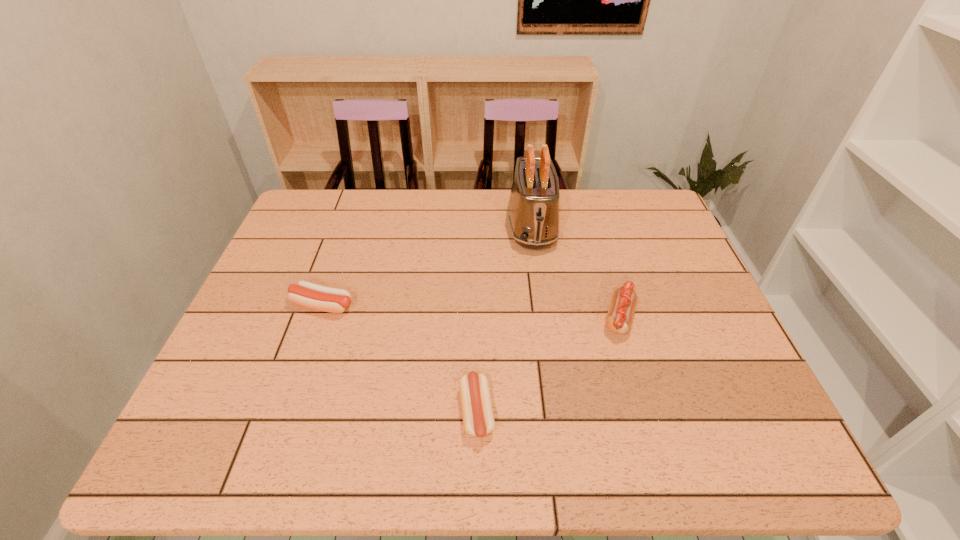
Select which object is the third closest to the leftmost sausage. Please provide its 2D coordinates. Your answer should be formatted as a tuple, i.e. [(x, y)], where the tuple contains the x and y coordinates of a point satisfying the conditions above.

[(619, 318)]

This screenshot has height=540, width=960. In order to click on sausage that is the closest to the toaster in this screenshot , I will do `click(619, 318)`.

Identify the location of sausage identified as the second closest to the leftmost sausage. (619, 318).

Locate an element on the screen. This screenshot has height=540, width=960. vacant space that satisfies the following two spatial constraints: 1. on the side of the farthest object with the control lever; 2. on the left side of the rightmost sausage is located at coordinates (544, 318).

This screenshot has width=960, height=540. In order to click on free space that satisfies the following two spatial constraints: 1. on the front side of the leftmost object; 2. on the left side of the nearest sausage in this screenshot , I will do `click(285, 413)`.

This screenshot has height=540, width=960. What are the coordinates of `vacant space that satisfies the following two spatial constraints: 1. on the side of the rightmost object with the control lever; 2. on the left side of the third object from left to right` in the screenshot? It's located at pos(544,318).

This screenshot has height=540, width=960. In order to click on vacant space that satisfies the following two spatial constraints: 1. on the side of the rightmost sausage with the control lever; 2. on the left side of the tallest object in this screenshot , I will do `click(544, 318)`.

Where is `free space in the image that satisfies the following two spatial constraints: 1. on the side of the second object from right to left with the control lever; 2. on the right side of the rightmost object`? This screenshot has height=540, width=960. free space in the image that satisfies the following two spatial constraints: 1. on the side of the second object from right to left with the control lever; 2. on the right side of the rightmost object is located at coordinates [544, 318].